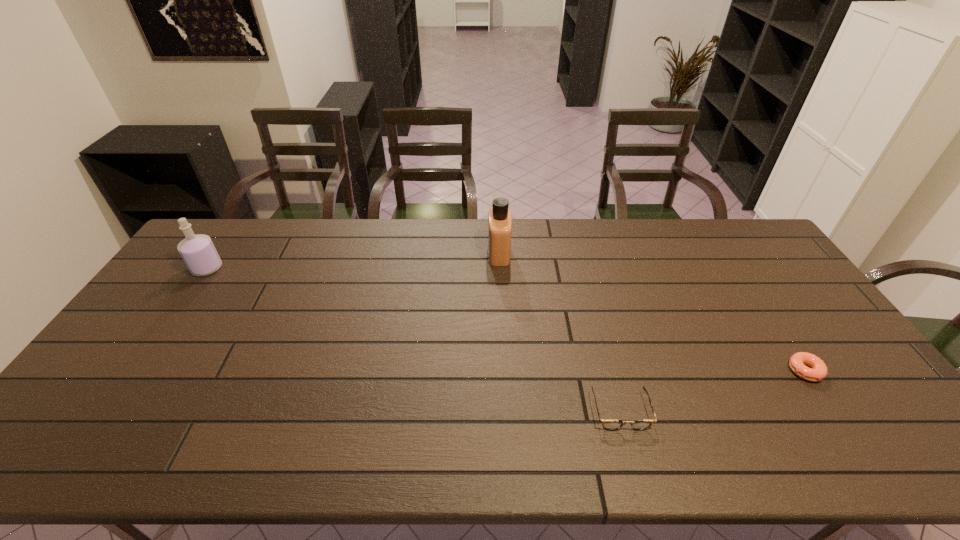
You are a GUI agent. You are given a task and a screenshot of the screen. Output one action in this format:
    pyautogui.click(x=<x>, y=<y>)
    Task: Click on the right perfume
    This screenshot has height=540, width=960.
    Given the screenshot: What is the action you would take?
    pyautogui.click(x=499, y=218)

At what (x,y) coordinates should I click in order to perform the action: click on the left perfume. Please return your answer as a coordinate pair (x, y). This screenshot has width=960, height=540. Looking at the image, I should click on (198, 251).

The width and height of the screenshot is (960, 540). What are the coordinates of `the third object from left to right` in the screenshot? It's located at (611, 425).

Identify the location of the second shortest object. Image resolution: width=960 pixels, height=540 pixels. (611, 425).

Locate an element on the screen. The image size is (960, 540). the third farthest object is located at coordinates (818, 371).

The height and width of the screenshot is (540, 960). I want to click on the shortest object, so (818, 371).

Locate an element on the screen. free location located on the front label of the third object from right to left is located at coordinates (436, 253).

Find the location of a particular element. The height and width of the screenshot is (540, 960). vacant space situated 0.110m on the front label of the third object from right to left is located at coordinates (456, 253).

Locate an element on the screen. Image resolution: width=960 pixels, height=540 pixels. free space located 0.230m on the front label of the third object from right to left is located at coordinates (421, 253).

Find the location of `free spot located 0.140m on the right of the left perfume`. free spot located 0.140m on the right of the left perfume is located at coordinates (264, 268).